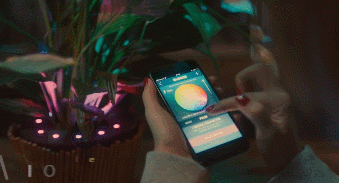
At what (x,y) coordinates should I click in order to perform the action: click on phone. Please return your answer as a coordinate pair (x, y). The height and width of the screenshot is (183, 339). Looking at the image, I should click on pos(195,130).